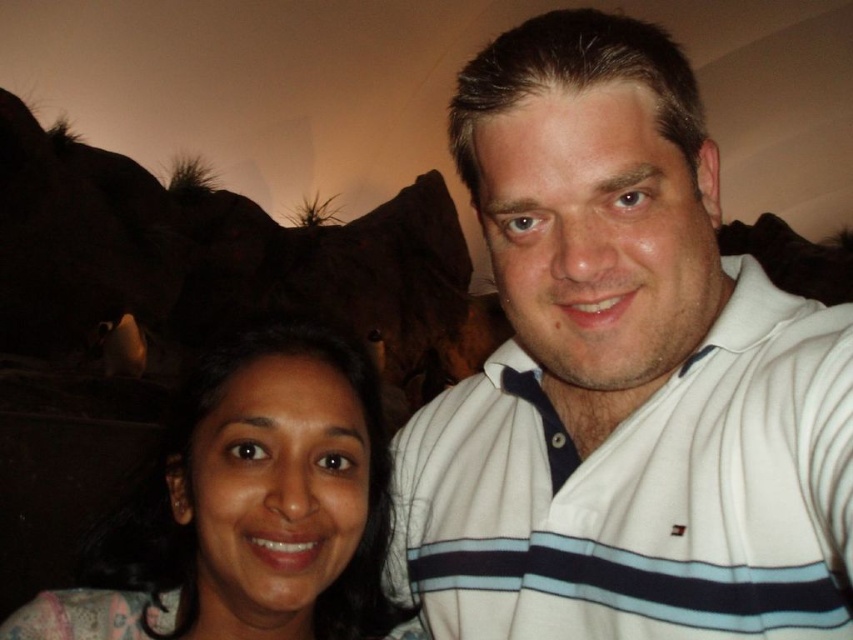
Can you confirm if white striped polo shirt at upper right is shorter than matte floral dress at lower left?

In fact, white striped polo shirt at upper right may be taller than matte floral dress at lower left.

Does white striped polo shirt at upper right have a greater height compared to matte floral dress at lower left?

Yes.

Between point (567, 621) and point (222, 536), which one is positioned in front?

Point (222, 536) is in front.

In order to click on white striped polo shirt at upper right in this screenshot , I will do `click(622, 378)`.